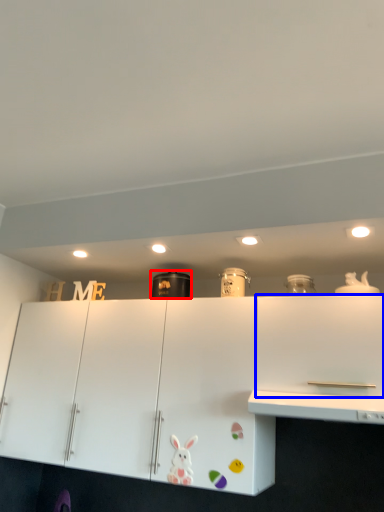
Question: Which point is closer to the camera, appliance (highlighted by a red box) or cabinetry (highlighted by a blue box)?

Choices:
 (A) appliance
 (B) cabinetry

Answer: (B)